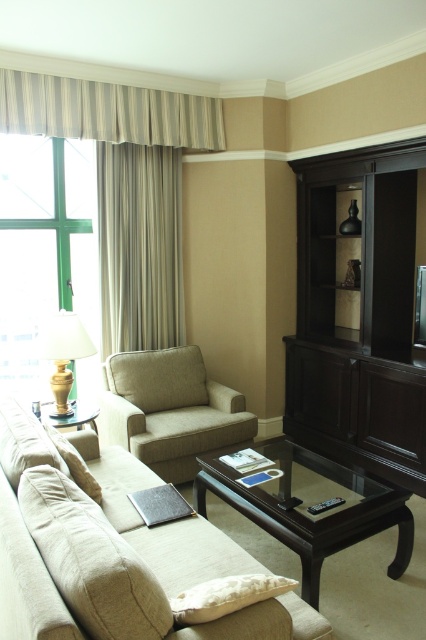
Question: Among these points, which one is farthest from the camera?

Choices:
 (A) (222, 131)
 (B) (219, 497)

Answer: (A)

Question: Can you confirm if beige fabric couch at lower left is wider than silky beige curtain at left?

Choices:
 (A) no
 (B) yes

Answer: (B)

Question: Which of the following is the closest to the observer?

Choices:
 (A) beige fabric armchair at center
 (B) striped fabric curtain at left
 (C) dark wood glass coffee table at center
 (D) matte beige lamp at left

Answer: (C)

Question: Can you confirm if beige fabric couch at lower left is smaller than green glass window at left?

Choices:
 (A) yes
 (B) no

Answer: (B)

Question: Can you confirm if dark wood entertainment center at right is smaller than striped fabric curtain at left?

Choices:
 (A) yes
 (B) no

Answer: (B)

Question: Which point is closer to the camera taking this photo?

Choices:
 (A) (325, 196)
 (B) (54, 627)
 (C) (143, 310)

Answer: (B)